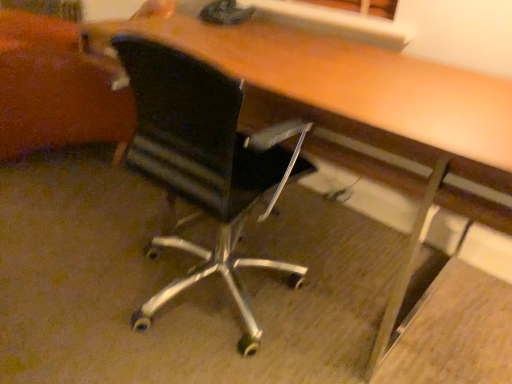
Question: Is black leather chair at center oriented away from black mesh swivel chair at left?

Choices:
 (A) no
 (B) yes

Answer: (A)

Question: Does black leather chair at center have a larger size compared to black mesh swivel chair at left?

Choices:
 (A) no
 (B) yes

Answer: (A)

Question: Can you confirm if black leather chair at center is shorter than black mesh swivel chair at left?

Choices:
 (A) no
 (B) yes

Answer: (A)

Question: Is black leather chair at center closer to camera compared to black mesh swivel chair at left?

Choices:
 (A) no
 (B) yes

Answer: (B)

Question: From the image's perspective, is black leather chair at center located above black mesh swivel chair at left?

Choices:
 (A) yes
 (B) no

Answer: (B)

Question: Does black leather chair at center appear on the left side of black mesh swivel chair at left?

Choices:
 (A) no
 (B) yes

Answer: (A)

Question: Can black leather chair at center be found inside black mesh swivel chair at left?

Choices:
 (A) no
 (B) yes

Answer: (A)

Question: Considering the relative sizes of black mesh swivel chair at left and black leather chair at center in the image provided, is black mesh swivel chair at left bigger than black leather chair at center?

Choices:
 (A) yes
 (B) no

Answer: (A)

Question: Considering the relative sizes of black mesh swivel chair at left and black leather chair at center in the image provided, is black mesh swivel chair at left thinner than black leather chair at center?

Choices:
 (A) yes
 (B) no

Answer: (B)

Question: Is black mesh swivel chair at left positioned before black leather chair at center?

Choices:
 (A) no
 (B) yes

Answer: (A)

Question: From the image's perspective, is black mesh swivel chair at left on black leather chair at center?

Choices:
 (A) yes
 (B) no

Answer: (A)

Question: Considering the relative positions of black mesh swivel chair at left and black leather chair at center in the image provided, is black mesh swivel chair at left to the right of black leather chair at center from the viewer's perspective?

Choices:
 (A) no
 (B) yes

Answer: (A)

Question: Does point (234, 241) appear closer or farther from the camera than point (34, 67)?

Choices:
 (A) farther
 (B) closer

Answer: (B)